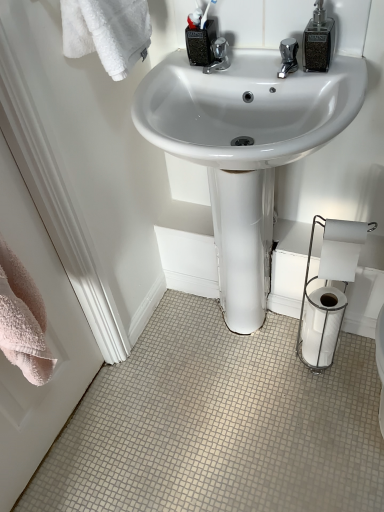
Question: Is white glossy toilet paper at lower right, which is counted as the 3th toilet paper, starting from the top, in front of white glossy sink at center?

Choices:
 (A) no
 (B) yes

Answer: (A)

Question: Could you tell me if white glossy toilet paper at lower right, which is counted as the 3th toilet paper, starting from the top, is facing white glossy sink at center?

Choices:
 (A) no
 (B) yes

Answer: (B)

Question: Can you confirm if white glossy toilet paper at lower right, which is the 1th toilet paper in bottom-to-top order, is smaller than white glossy sink at center?

Choices:
 (A) no
 (B) yes

Answer: (B)

Question: Is white glossy toilet paper at lower right, which is the 1th toilet paper in bottom-to-top order, positioned far away from white glossy sink at center?

Choices:
 (A) no
 (B) yes

Answer: (A)

Question: From the image's perspective, is white glossy toilet paper at lower right, which is counted as the 3th toilet paper, starting from the top, on top of white glossy sink at center?

Choices:
 (A) yes
 (B) no

Answer: (B)

Question: Choose the correct answer: Is matte black container at upper center inside white glossy toilet paper at lower right, which is the 1th toilet paper in bottom-to-top order, or outside it?

Choices:
 (A) inside
 (B) outside

Answer: (B)

Question: Considering the positions of matte black container at upper center and white glossy toilet paper at lower right, which is counted as the 3th toilet paper, starting from the top, in the image, is matte black container at upper center wider or thinner than white glossy toilet paper at lower right, which is counted as the 3th toilet paper, starting from the top,?

Choices:
 (A) thin
 (B) wide

Answer: (A)

Question: Considering the positions of point (193, 32) and point (334, 291), is point (193, 32) closer or farther from the camera than point (334, 291)?

Choices:
 (A) closer
 (B) farther

Answer: (A)

Question: Considering the positions of matte black container at upper center and white glossy toilet paper at lower right, which is the 1th toilet paper in bottom-to-top order, in the image, is matte black container at upper center taller or shorter than white glossy toilet paper at lower right, which is the 1th toilet paper in bottom-to-top order,?

Choices:
 (A) short
 (B) tall

Answer: (A)

Question: Choose the correct answer: Is pink towel at left inside white glossy sink at center or outside it?

Choices:
 (A) inside
 (B) outside

Answer: (B)

Question: Does point [6, 470] appear closer or farther from the camera than point [147, 129]?

Choices:
 (A) farther
 (B) closer

Answer: (A)

Question: In terms of width, does pink towel at left look wider or thinner when compared to white glossy sink at center?

Choices:
 (A) wide
 (B) thin

Answer: (B)

Question: Relative to white glossy sink at center, is pink towel at left in front or behind?

Choices:
 (A) behind
 (B) front

Answer: (B)

Question: Considering the relative positions of white glossy toilet paper at lower right, which is the 1th toilet paper in bottom-to-top order, and white glossy sink at center in the image provided, is white glossy toilet paper at lower right, which is the 1th toilet paper in bottom-to-top order, to the left or to the right of white glossy sink at center?

Choices:
 (A) right
 (B) left

Answer: (A)

Question: In terms of width, does white glossy toilet paper at lower right, which is the 1th toilet paper in bottom-to-top order, look wider or thinner when compared to white glossy sink at center?

Choices:
 (A) wide
 (B) thin

Answer: (B)